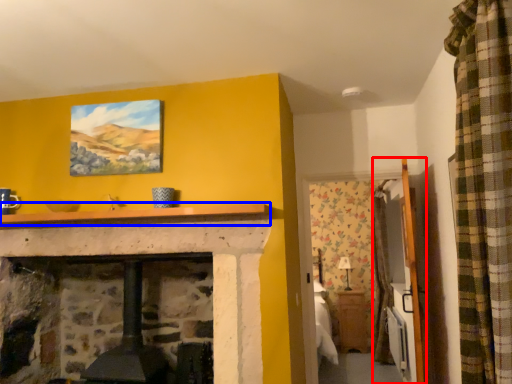
Question: Which object is further to the camera taking this photo, armoire (highlighted by a red box) or mantle (highlighted by a blue box)?

Choices:
 (A) armoire
 (B) mantle

Answer: (A)